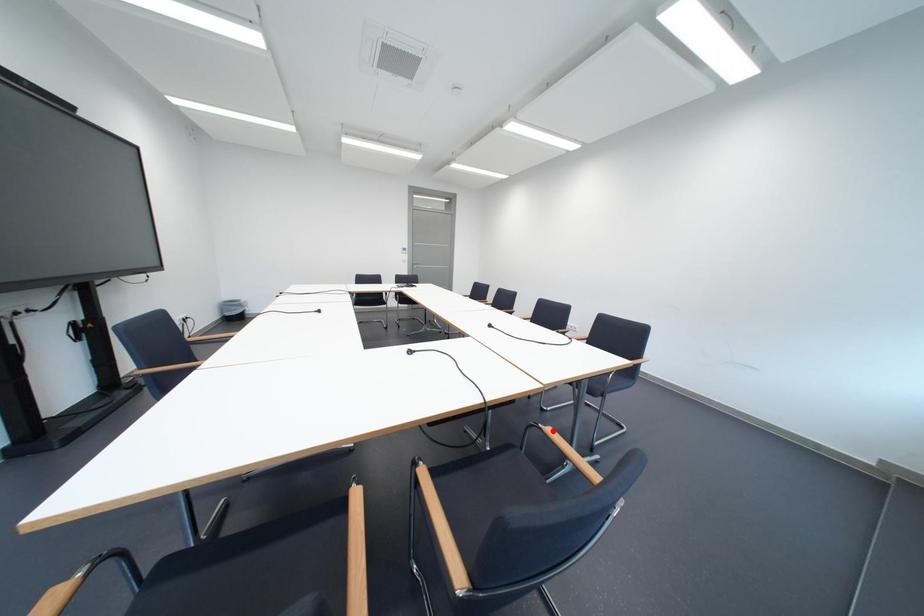
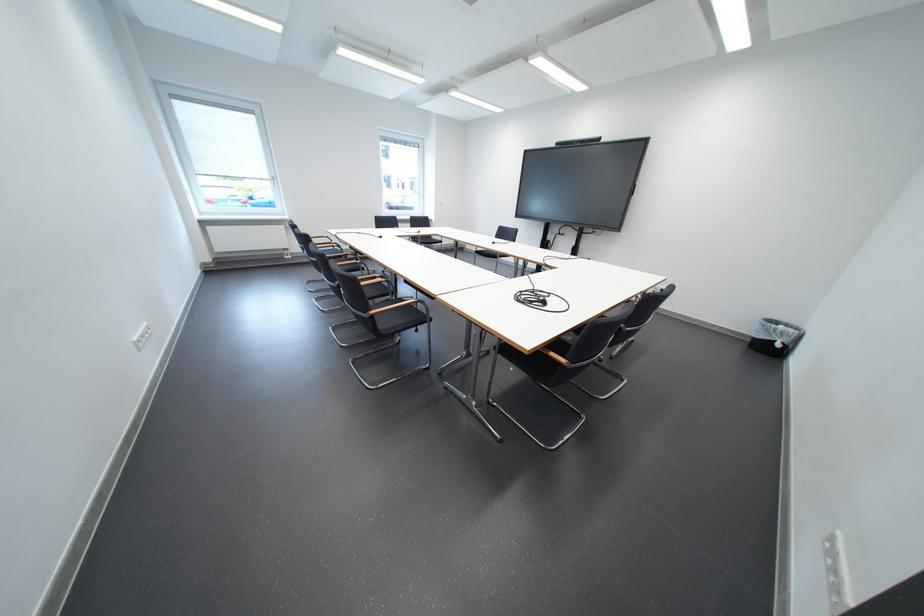
Question: I am providing you with two images of the same scene from different viewpoints. A red point is marked on the first image. Is the red point's position out of view in image 2?

Choices:
 (A) Yes
 (B) No

Answer: (A)